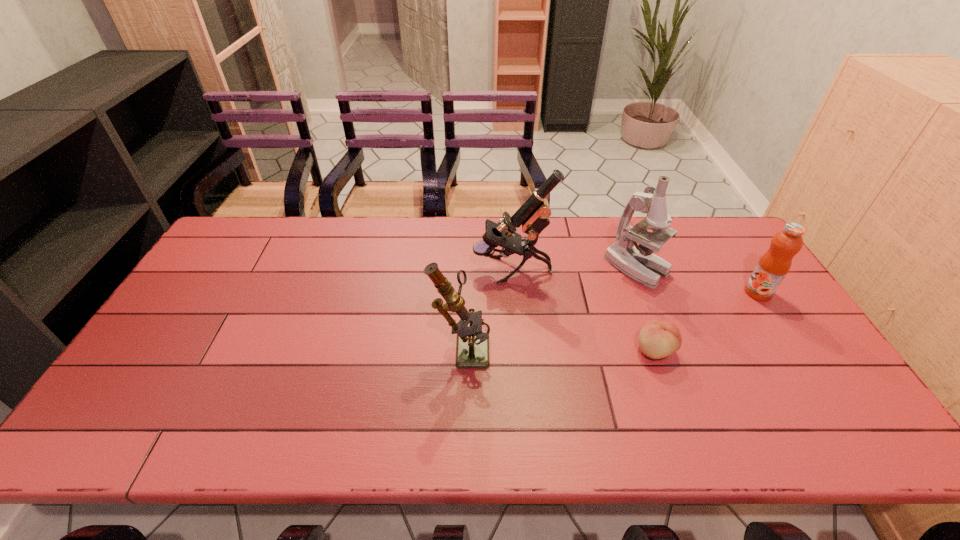
The height and width of the screenshot is (540, 960). What are the coordinates of `vacant space positioned on the left of the shortest object` in the screenshot? It's located at (526, 350).

You are a GUI agent. You are given a task and a screenshot of the screen. Output one action in this format:
    pyautogui.click(x=<x>, y=<y>)
    Task: Click on the object positioned at the right edge
    The height and width of the screenshot is (540, 960).
    Given the screenshot: What is the action you would take?
    pyautogui.click(x=773, y=266)

The height and width of the screenshot is (540, 960). I want to click on free space at the far edge of the desktop, so click(x=604, y=231).

Locate an element on the screen. vacant space at the near edge of the desktop is located at coordinates (280, 447).

Where is `vacant space at the left edge`? This screenshot has width=960, height=540. vacant space at the left edge is located at coordinates (216, 300).

This screenshot has width=960, height=540. What are the coordinates of `vacant space at the right edge` in the screenshot? It's located at (739, 303).

Where is `vacant space at the near left corner of the desktop`? The height and width of the screenshot is (540, 960). vacant space at the near left corner of the desktop is located at coordinates (124, 443).

Locate an element on the screen. vacant area that lies between the rightmost microscope and the nearest microscope is located at coordinates (549, 307).

Identify the location of vacant area between the nearest microscope and the peach. (558, 348).

Where is `unoccupied position between the rightmost microscope and the fourth tallest object`? The height and width of the screenshot is (540, 960). unoccupied position between the rightmost microscope and the fourth tallest object is located at coordinates (698, 280).